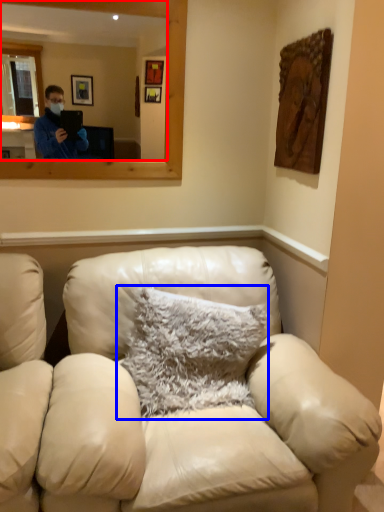
Question: Which object appears farthest to the camera in this image, mirror (highlighted by a red box) or pillow (highlighted by a blue box)?

Choices:
 (A) mirror
 (B) pillow

Answer: (A)